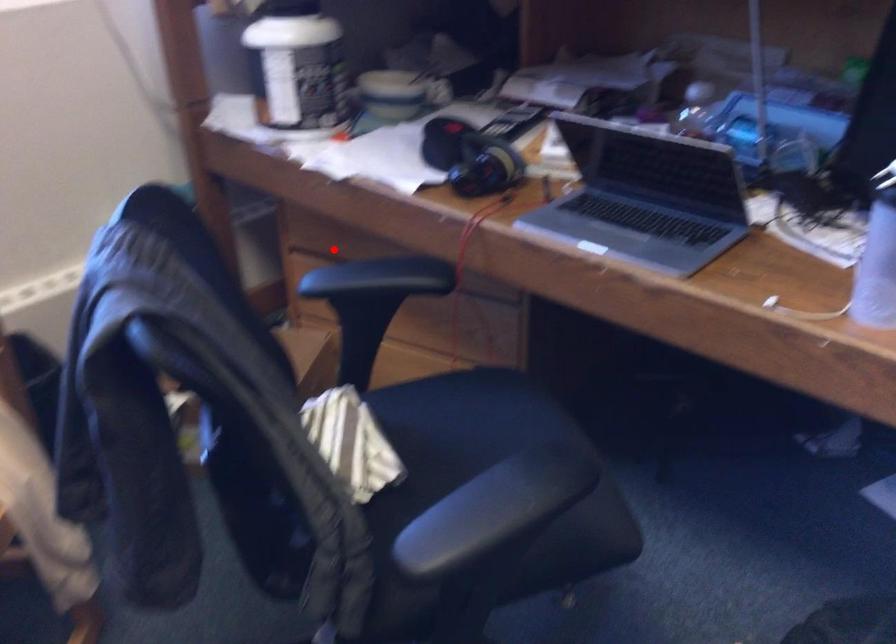
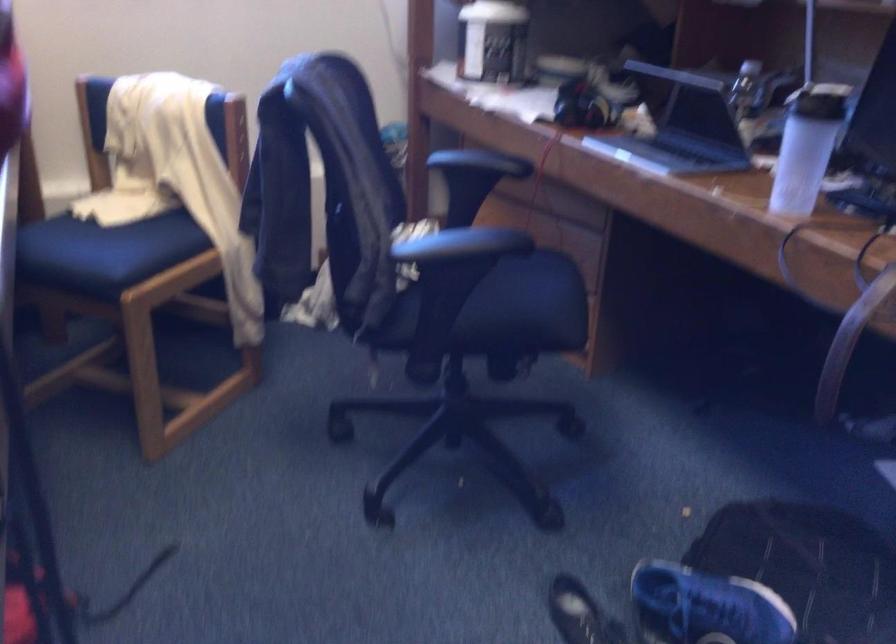
Question: I am providing you with two images of the same scene from different viewpoints. A red point is marked on the first image. Is the red point's position out of view in image 2?

Choices:
 (A) Yes
 (B) No

Answer: (A)